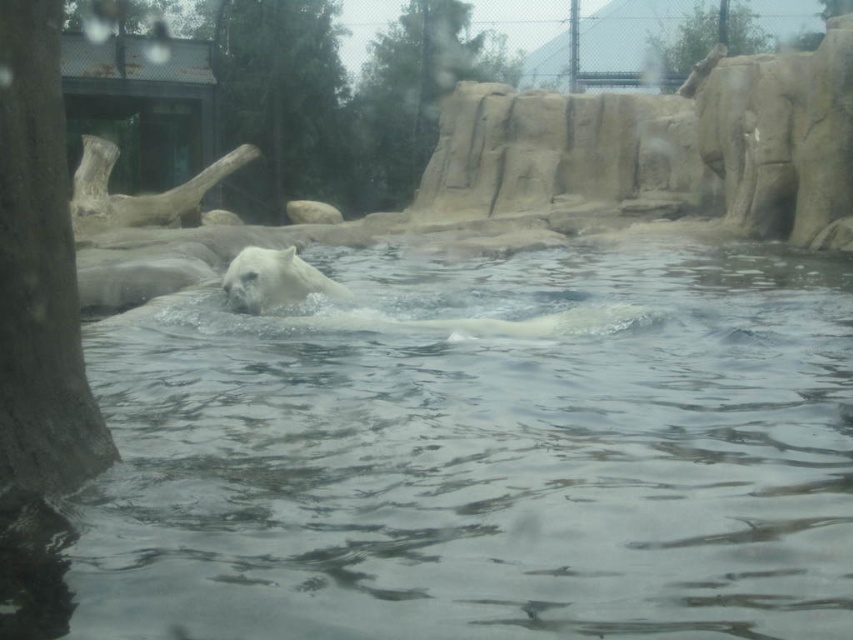
You are a visitor at the zoo and want to take a photo of the polar bear. The clear water at center and the green leafy tree at upper center are both in your viewfinder. Which object is closer to the camera based on their positions in the scene?

The clear water at center is closer to the camera than the green leafy tree at upper center because the clear water at center has a lesser height compared to green leafy tree at upper center.

You are a zookeeper standing at the edge of the polar bear pool. You notice two points marked in the image. Which of the two points, point (482, 397) or point (233, 36), is closer to you?

Point (482, 397) is closer to the viewer than point (233, 36).

You are a visitor at the zoo and want to take a photo of both the smooth bark tree at left and the green leafy tree at upper center in the same frame. Based on their positions, which tree should you focus on first to ensure both are in the shot?

The smooth bark tree at left is to the left of green leafy tree at upper center, so you should focus on the green leafy tree at upper center first to ensure both are in the frame.